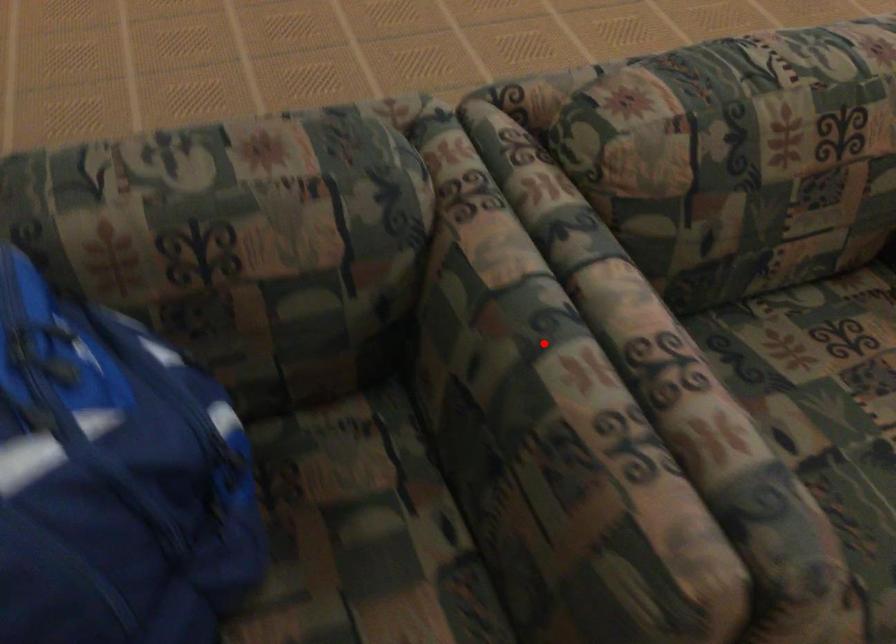
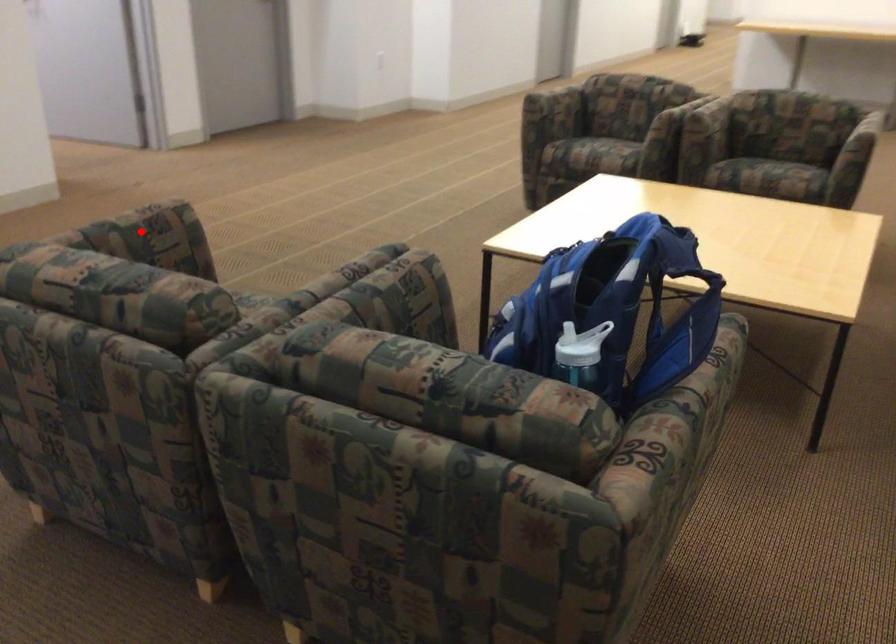
I am providing you with two images of the same scene from different viewpoints. A red point is marked on the first image and another point is marked on the second image. Are the points marked in image1 and image2 representing the same 3D position?

No